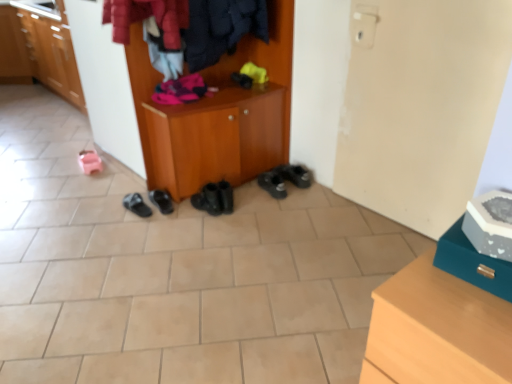
The height and width of the screenshot is (384, 512). Find the location of `free space in front of wooden cabinet at center, which appears as the second cabinetry when viewed from the left`. free space in front of wooden cabinet at center, which appears as the second cabinetry when viewed from the left is located at coordinates (212, 241).